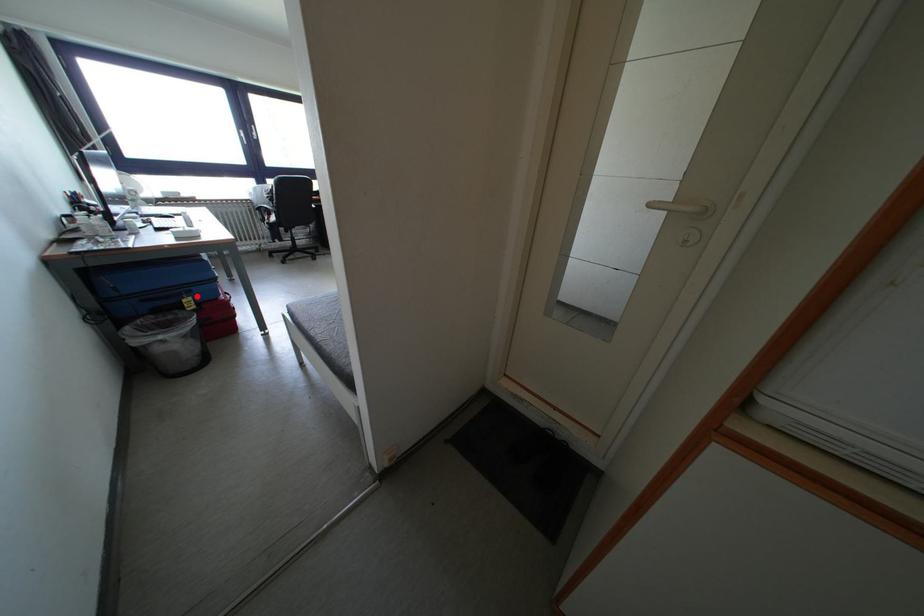
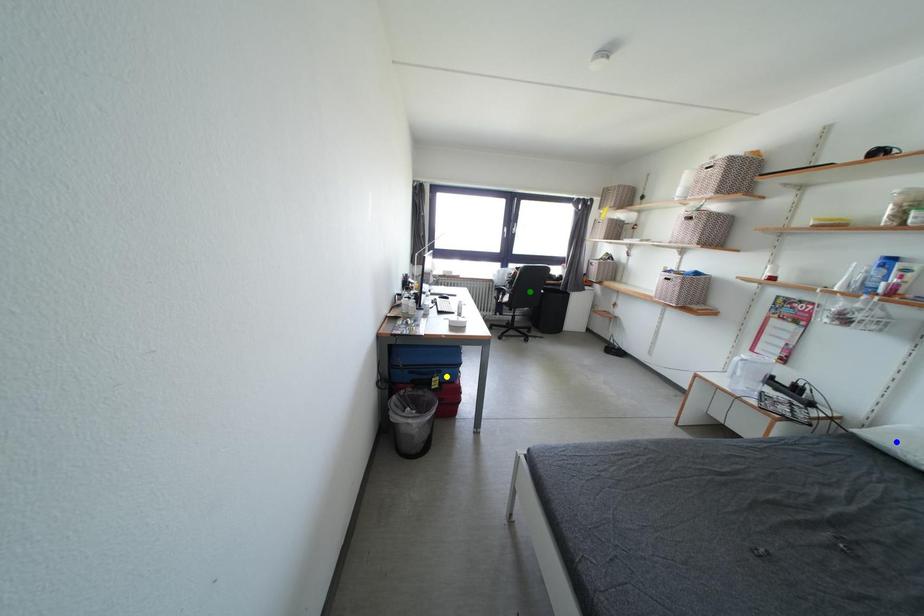
Question: I am providing you with two images of the same scene from different viewpoints. A red point is marked on the first image. You are given multiple points on the second image. Which point in image 2 is actually the same real-world point as the red point in image 1?

Choices:
 (A) blue point
 (B) green point
 (C) yellow point

Answer: (C)